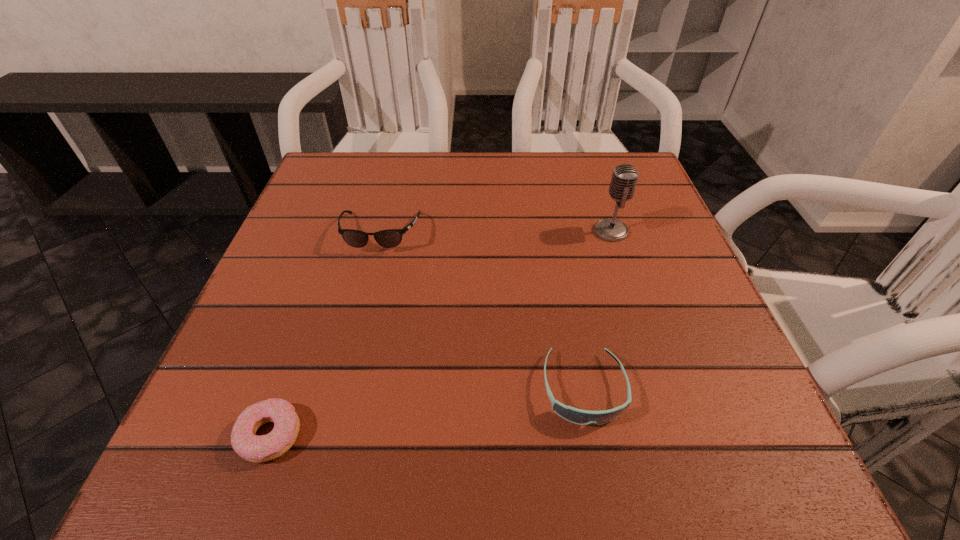
Identify the location of free space between the doughnut and the second object from right to left. (426, 412).

Locate which object is the closest to the sunglasses. Please provide its 2D coordinates. Your answer should be formatted as a tuple, i.e. [(x, y)], where the tuple contains the x and y coordinates of a point satisfying the conditions above.

[(581, 417)]

I want to click on object that is the closest one to the third object from left to right, so click(624, 179).

The image size is (960, 540). Find the location of `vacant position in the image that satisfies the following two spatial constraints: 1. on the back side of the doughnut; 2. on the left side of the tallest object`. vacant position in the image that satisfies the following two spatial constraints: 1. on the back side of the doughnut; 2. on the left side of the tallest object is located at coordinates (341, 231).